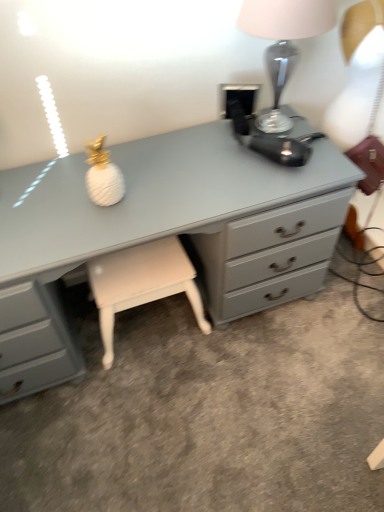
Locate an element on the screen. free spot to the right of white leather stool at center is located at coordinates (241, 351).